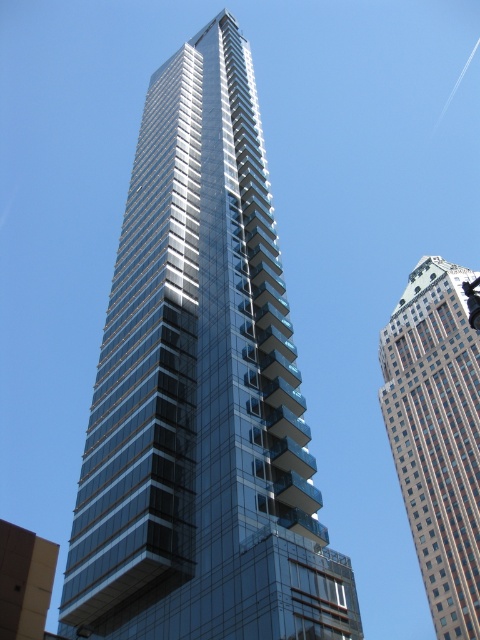
You are an architect analyzing the urban layout. Given that the glassy metallic skyscraper at center and the brown brick building at upper right are both visible in the image, which one has a narrower width when viewed from this perspective?

The glassy metallic skyscraper at center is thinner than the brown brick building at upper right, so it has a narrower width from this perspective.

You are standing in front of the modern skyscraper and want to reach the point at coordinates (189,456). If you walk directly towards it, how far will you have to walk?

The point at coordinates (189,456) is 163.98 feet away from the viewer, so you will have to walk 163.98 feet to reach it.

You are an architect analyzing the urban layout. Given that the glassy metallic skyscraper at center and the brown brick building at upper right are both visible from your observation point, which one would appear closer to you based on their sizes in the image?

The glassy metallic skyscraper at center appears closer because it is larger in size than the brown brick building at upper right in the image.